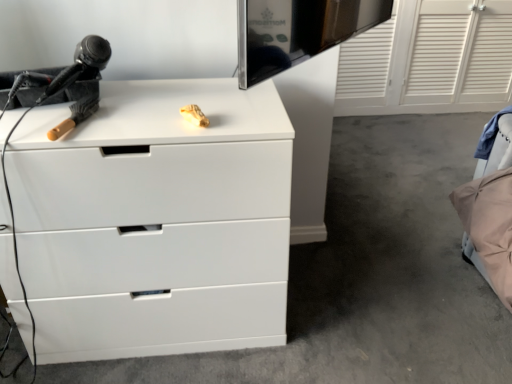
I want to click on black plastic hairdryer at left, so pyautogui.click(x=58, y=78).

Can you confirm if black plastic hairdryer at left is smaller than beige fabric bed at lower right?

Indeed, black plastic hairdryer at left has a smaller size compared to beige fabric bed at lower right.

Considering the sizes of objects black plastic hairdryer at left and beige fabric bed at lower right in the image provided, who is taller, black plastic hairdryer at left or beige fabric bed at lower right?

beige fabric bed at lower right is taller.

Is black plastic hairdryer at left turned away from beige fabric bed at lower right?

No, black plastic hairdryer at left is not facing away from beige fabric bed at lower right.

Would you say black plastic hairdryer at left is a long distance from beige fabric bed at lower right?

Yes, black plastic hairdryer at left and beige fabric bed at lower right are located far from each other.

Considering the sizes of objects beige fabric bed at lower right and black plastic hairdryer at left in the image provided, who is thinner, beige fabric bed at lower right or black plastic hairdryer at left?

Thinner between the two is black plastic hairdryer at left.

Could you tell me if beige fabric bed at lower right is facing black plastic hairdryer at left?

No.

From the image's perspective, between beige fabric bed at lower right and black plastic hairdryer at left, which one is located above?

black plastic hairdryer at left appears higher in the image.

How far apart are beige fabric bed at lower right and black plastic hairdryer at left?

4.38 feet.

Is white matte chest of drawers at center positioned beyond the bounds of black plastic hairdryer at left?

Yes.

From the picture: Which object is more forward, white matte chest of drawers at center or black plastic hairdryer at left?

white matte chest of drawers at center is more forward.

Between white matte chest of drawers at center and black plastic hairdryer at left, which one has larger width?

white matte chest of drawers at center.

Based on the photo, would you say white matte chest of drawers at center is to the left or to the right of black plastic hairdryer at left in the picture?

From the image, it's evident that white matte chest of drawers at center is to the right of black plastic hairdryer at left.

How many degrees apart are the facing directions of white matte chest of drawers at center and beige fabric bed at lower right?

The facing directions of white matte chest of drawers at center and beige fabric bed at lower right are 180 degrees apart.

Who is bigger, white matte chest of drawers at center or beige fabric bed at lower right?

white matte chest of drawers at center is bigger.

From the image's perspective, does white matte chest of drawers at center appear higher than beige fabric bed at lower right?

No.

Is white matte chest of drawers at center spatially inside beige fabric bed at lower right, or outside of it?

The correct answer is: outside.

From the image's perspective, is black plastic hairdryer at left located above or below white matte chest of drawers at center?

Clearly, from the image's perspective, black plastic hairdryer at left is above white matte chest of drawers at center.

Are black plastic hairdryer at left and white matte chest of drawers at center making contact?

They are not placed beside each other.

Does black plastic hairdryer at left have a lesser height compared to white matte chest of drawers at center?

Indeed, black plastic hairdryer at left has a lesser height compared to white matte chest of drawers at center.

At what (x,y) coordinates should I click in order to perform the action: click on the chest of drawers beneath the black plastic hairdryer at left (from a real-world perspective). Please return your answer as a coordinate pair (x, y). Image resolution: width=512 pixels, height=384 pixels. Looking at the image, I should click on (155, 220).

Does beige fabric bed at lower right touch white matte chest of drawers at center?

No, beige fabric bed at lower right is not making contact with white matte chest of drawers at center.

From a real-world perspective, who is located higher, beige fabric bed at lower right or white matte chest of drawers at center?

In real-world perspective, white matte chest of drawers at center is above.

Can you confirm if beige fabric bed at lower right is smaller than white matte chest of drawers at center?

Yes.

Consider the image. Is beige fabric bed at lower right positioned with its back to white matte chest of drawers at center?

beige fabric bed at lower right does not have its back to white matte chest of drawers at center.

The image size is (512, 384). Find the location of `equipment that appears on the left of beige fabric bed at lower right`. equipment that appears on the left of beige fabric bed at lower right is located at coordinates (58, 78).

You are a GUI agent. You are given a task and a screenshot of the screen. Output one action in this format:
    pyautogui.click(x=<x>, y=<y>)
    Task: Click on the equipment above the beige fabric bed at lower right (from a real-world perspective)
    
    Given the screenshot: What is the action you would take?
    pyautogui.click(x=58, y=78)

Which object lies nearer to the anchor point black plastic hairdryer at left, white matte chest of drawers at center or beige fabric bed at lower right?

white matte chest of drawers at center is positioned closer to the anchor black plastic hairdryer at left.

When comparing their distances from beige fabric bed at lower right, does black plastic hairdryer at left or white matte chest of drawers at center seem closer?

Among the two, white matte chest of drawers at center is located nearer to beige fabric bed at lower right.

When comparing their distances from beige fabric bed at lower right, does white matte chest of drawers at center or black plastic hairdryer at left seem closer?

white matte chest of drawers at center is positioned closer to the anchor beige fabric bed at lower right.

When comparing their distances from black plastic hairdryer at left, does beige fabric bed at lower right or white matte chest of drawers at center seem closer?

white matte chest of drawers at center.

When comparing their distances from white matte chest of drawers at center, does black plastic hairdryer at left or beige fabric bed at lower right seem further?

beige fabric bed at lower right is positioned further to the anchor white matte chest of drawers at center.

Estimate the real-world distances between objects in this image. Which object is closer to white matte chest of drawers at center, beige fabric bed at lower right or black plastic hairdryer at left?

black plastic hairdryer at left lies closer to white matte chest of drawers at center than the other object.

Where is `the chest of drawers situated between black plastic hairdryer at left and beige fabric bed at lower right from left to right`? the chest of drawers situated between black plastic hairdryer at left and beige fabric bed at lower right from left to right is located at coordinates (155, 220).